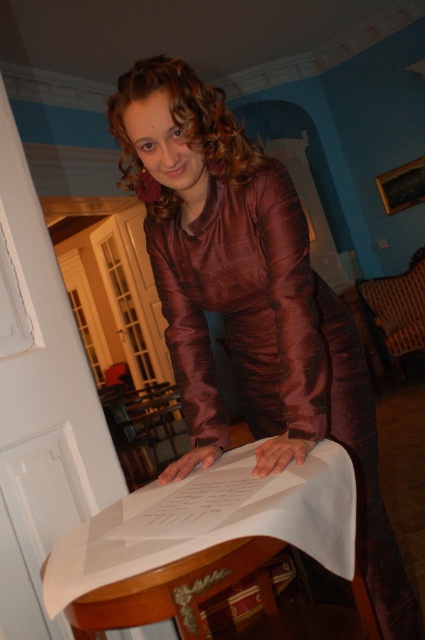
Question: Which point is farther to the camera?

Choices:
 (A) matte purple dress at center
 (B) white paper at center

Answer: (A)

Question: Which of the following is the closest to the observer?

Choices:
 (A) white paper at center
 (B) brown fabric chair at lower right

Answer: (A)

Question: Does matte purple dress at center come behind brown fabric chair at lower right?

Choices:
 (A) no
 (B) yes

Answer: (A)

Question: Is matte purple dress at center smaller than brown fabric chair at lower right?

Choices:
 (A) yes
 (B) no

Answer: (B)

Question: Which point is farther from the camera taking this photo?

Choices:
 (A) (93, 580)
 (B) (170, 68)
 (C) (371, 316)

Answer: (C)

Question: Is matte purple dress at center above brown fabric chair at lower right?

Choices:
 (A) no
 (B) yes

Answer: (A)